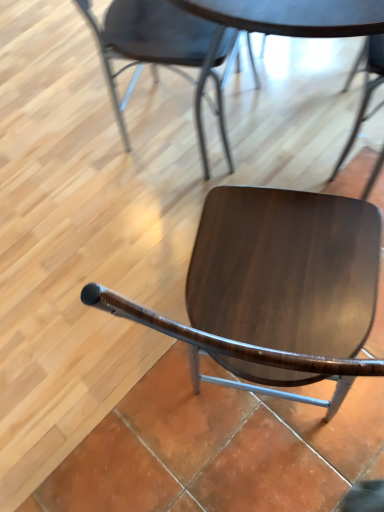
Find the location of a particular element. This screenshot has height=512, width=384. vacant space in front of matte black chair at upper center is located at coordinates (195, 198).